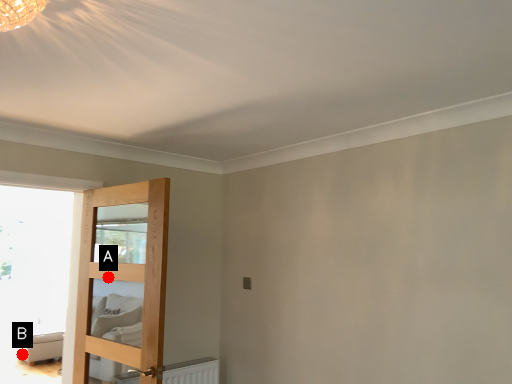
Question: Two points are circled on the image, labeled by A and B beside each circle. Which of the following is the closest to the observer?

Choices:
 (A) A is closer
 (B) B is closer

Answer: (A)